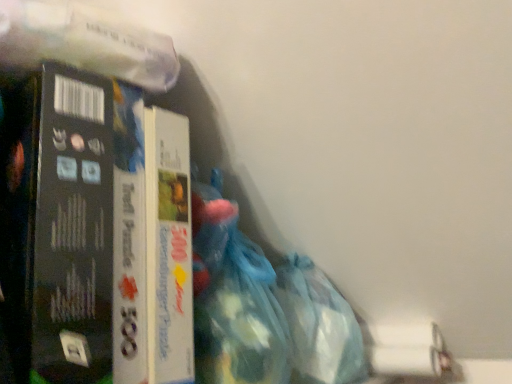
Question: From the image's perspective, is translucent blue plastic bag at lower right above or below matte cardboard puzzle box at left?

Choices:
 (A) below
 (B) above

Answer: (A)

Question: Does point (304, 294) appear closer or farther from the camera than point (79, 309)?

Choices:
 (A) closer
 (B) farther

Answer: (B)

Question: Which object is positioned farthest from the translucent blue plastic bag at lower right?

Choices:
 (A) translucent plastic bag at lower center
 (B) matte cardboard puzzle box at left

Answer: (B)

Question: Which of these objects is positioned farthest from the translucent plastic bag at lower center?

Choices:
 (A) translucent blue plastic bag at lower right
 (B) matte cardboard puzzle box at left

Answer: (B)